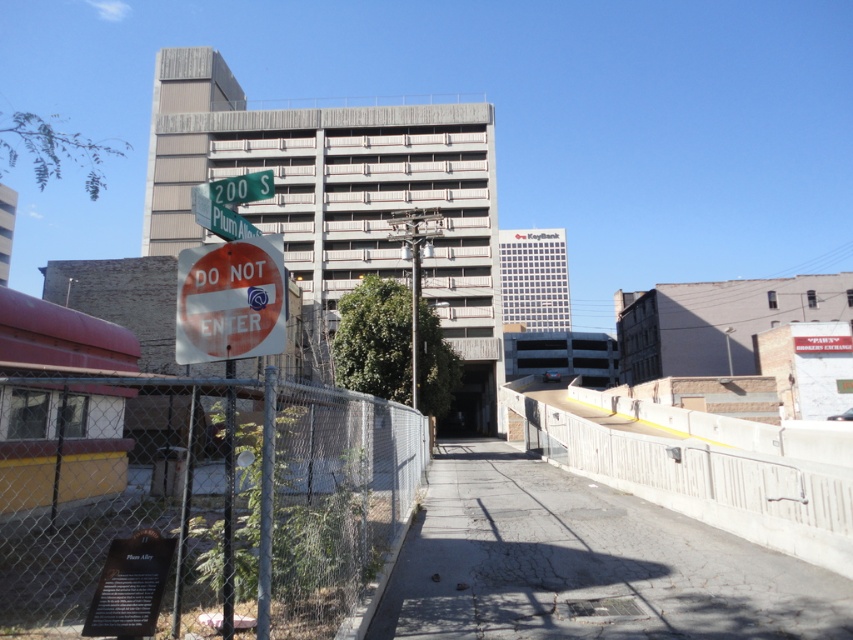
You are a delivery person standing at the entrance of the alleyway. You need to place a package on the ground exactly 3 meters away from the chain link fence at lower left. Is this possible given the current setup?

The chain link fence at lower left is 3.35 meters away from the camera. Since the delivery person is standing at the entrance of the alleyway, placing the package 3 meters from the fence would require positioning it 0.35 meters closer to the camera than the fence. This is feasible as long as there is enough space between the camera and the fence to accommodate the 3 meters distance.

You are a delivery person trying to enter the alleyway through the pathway. The chain link fence at lower left has a small opening. Can you pass through the opening to reach the concrete at center?

The chain link fence at lower left is in front of concrete at center, so you can pass through the opening in the chain link fence at lower left to reach the concrete at center.